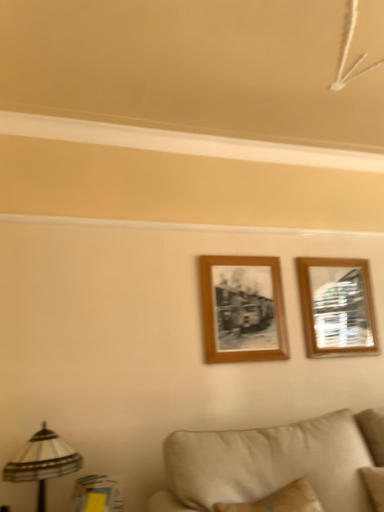
What do you see at coordinates (337, 307) in the screenshot?
I see `wooden picture frame at upper right, marked as the 2th picture frame in a left-to-right arrangement` at bounding box center [337, 307].

What is the approximate width of wooden picture frame at upper right, marked as the 2th picture frame in a left-to-right arrangement?

1.64 inches.

Describe the element at coordinates (243, 309) in the screenshot. I see `wooden photo frame at center, placed as the 1th picture frame when sorted from left to right` at that location.

Measure the distance between point (41, 470) and camera.

5.77 feet.

Locate an element on the screen. beige fabric couch at lower center is located at coordinates (278, 467).

Does wooden photo frame at center, placed as the 1th picture frame when sorted from left to right, have a lesser width compared to beige fabric couch at lower center?

Indeed, wooden photo frame at center, placed as the 1th picture frame when sorted from left to right, has a lesser width compared to beige fabric couch at lower center.

Is wooden photo frame at center, placed as the 1th picture frame when sorted from left to right, positioned with its back to beige fabric couch at lower center?

wooden photo frame at center, placed as the 1th picture frame when sorted from left to right, is not turned away from beige fabric couch at lower center.

Is wooden photo frame at center, which is the second picture frame in right-to-left order, bigger than beige fabric couch at lower center?

No.

From the picture: Considering the relative positions of wooden photo frame at center, which is the second picture frame in right-to-left order, and beige fabric couch at lower center in the image provided, is wooden photo frame at center, which is the second picture frame in right-to-left order, to the right of beige fabric couch at lower center from the viewer's perspective?

Incorrect, wooden photo frame at center, which is the second picture frame in right-to-left order, is not on the right side of beige fabric couch at lower center.

Is beige fabric couch at lower center outside of striped fabric lampshade at lower left?

Yes, beige fabric couch at lower center is not within striped fabric lampshade at lower left.

From the image's perspective, who appears lower, beige fabric couch at lower center or striped fabric lampshade at lower left?

striped fabric lampshade at lower left is shown below in the image.

Is beige fabric couch at lower center with striped fabric lampshade at lower left?

No, beige fabric couch at lower center is not with striped fabric lampshade at lower left.

Can you confirm if beige fabric couch at lower center is smaller than striped fabric lampshade at lower left?

Actually, beige fabric couch at lower center might be larger than striped fabric lampshade at lower left.

Which is more to the left, striped fabric lampshade at lower left or wooden picture frame at upper right, marked as the first picture frame in a right-to-left arrangement?

Positioned to the left is striped fabric lampshade at lower left.

From the image's perspective, is striped fabric lampshade at lower left located beneath wooden picture frame at upper right, marked as the first picture frame in a right-to-left arrangement?

Indeed, from the image's perspective, striped fabric lampshade at lower left is shown beneath wooden picture frame at upper right, marked as the first picture frame in a right-to-left arrangement.

Is striped fabric lampshade at lower left facing towards wooden picture frame at upper right, marked as the 2th picture frame in a left-to-right arrangement?

No, striped fabric lampshade at lower left is not oriented towards wooden picture frame at upper right, marked as the 2th picture frame in a left-to-right arrangement.

Is striped fabric lampshade at lower left located outside beige fabric couch at lower center?

Indeed, striped fabric lampshade at lower left is completely outside beige fabric couch at lower center.

Does striped fabric lampshade at lower left appear on the right side of beige fabric couch at lower center?

Incorrect, striped fabric lampshade at lower left is not on the right side of beige fabric couch at lower center.

Which is nearer, (30, 468) or (301, 455)?

Point (30, 468).

Does striped fabric lampshade at lower left have a smaller size compared to beige fabric couch at lower center?

Yes.

Where is `table lamp below the wooden picture frame at upper right, marked as the first picture frame in a right-to-left arrangement (from the image's perspective)`? table lamp below the wooden picture frame at upper right, marked as the first picture frame in a right-to-left arrangement (from the image's perspective) is located at coordinates (42, 462).

Can you see wooden picture frame at upper right, marked as the 2th picture frame in a left-to-right arrangement, touching striped fabric lampshade at lower left?

They are not placed beside each other.

Can we say wooden picture frame at upper right, marked as the 2th picture frame in a left-to-right arrangement, lies outside striped fabric lampshade at lower left?

Yes, wooden picture frame at upper right, marked as the 2th picture frame in a left-to-right arrangement, is located beyond the bounds of striped fabric lampshade at lower left.

Based on their positions, is wooden picture frame at upper right, marked as the 2th picture frame in a left-to-right arrangement, located to the left or right of striped fabric lampshade at lower left?

wooden picture frame at upper right, marked as the 2th picture frame in a left-to-right arrangement, is positioned on striped fabric lampshade at lower left's right side.

Can you confirm if beige fabric couch at lower center is shorter than wooden picture frame at upper right, marked as the first picture frame in a right-to-left arrangement?

Yes, beige fabric couch at lower center is shorter than wooden picture frame at upper right, marked as the first picture frame in a right-to-left arrangement.

How different are the orientations of beige fabric couch at lower center and wooden picture frame at upper right, marked as the 2th picture frame in a left-to-right arrangement, in degrees?

The facing directions of beige fabric couch at lower center and wooden picture frame at upper right, marked as the 2th picture frame in a left-to-right arrangement, are 1.05 degrees apart.

Are beige fabric couch at lower center and wooden picture frame at upper right, marked as the 2th picture frame in a left-to-right arrangement, making contact?

No, beige fabric couch at lower center is not next to wooden picture frame at upper right, marked as the 2th picture frame in a left-to-right arrangement.

From a real-world perspective, is beige fabric couch at lower center on top of wooden photo frame at center, placed as the 1th picture frame when sorted from left to right?

No, from a real-world perspective, beige fabric couch at lower center is not on top of wooden photo frame at center, placed as the 1th picture frame when sorted from left to right.

In the image, is beige fabric couch at lower center on the left side or the right side of wooden photo frame at center, placed as the 1th picture frame when sorted from left to right?

beige fabric couch at lower center is positioned on wooden photo frame at center, placed as the 1th picture frame when sorted from left to right,'s right side.

How different are the orientations of beige fabric couch at lower center and wooden photo frame at center, which is the second picture frame in right-to-left order, in degrees?

0.644 degrees.

From the image's perspective, who appears lower, beige fabric couch at lower center or wooden photo frame at center, placed as the 1th picture frame when sorted from left to right?

From the image's view, beige fabric couch at lower center is below.

Where is `studio couch lying in front of the wooden photo frame at center, which is the second picture frame in right-to-left order`? The image size is (384, 512). studio couch lying in front of the wooden photo frame at center, which is the second picture frame in right-to-left order is located at coordinates (278, 467).

Where is `table lamp lying below the beige fabric couch at lower center (from the image's perspective)`? table lamp lying below the beige fabric couch at lower center (from the image's perspective) is located at coordinates click(x=42, y=462).

Estimate the real-world distances between objects in this image. Which object is further from beige fabric couch at lower center, striped fabric lampshade at lower left or wooden photo frame at center, which is the second picture frame in right-to-left order?

striped fabric lampshade at lower left is positioned further to the anchor beige fabric couch at lower center.

Looking at this image, considering their positions, is beige fabric couch at lower center positioned further to wooden picture frame at upper right, marked as the 2th picture frame in a left-to-right arrangement, than wooden photo frame at center, placed as the 1th picture frame when sorted from left to right?

Based on the image, beige fabric couch at lower center appears to be further to wooden picture frame at upper right, marked as the 2th picture frame in a left-to-right arrangement.

Considering their positions, is beige fabric couch at lower center positioned closer to striped fabric lampshade at lower left than wooden picture frame at upper right, marked as the first picture frame in a right-to-left arrangement?

Among the two, beige fabric couch at lower center is located nearer to striped fabric lampshade at lower left.

Which object lies nearer to the anchor point striped fabric lampshade at lower left, beige fabric couch at lower center or wooden photo frame at center, which is the second picture frame in right-to-left order?

The object closer to striped fabric lampshade at lower left is beige fabric couch at lower center.

Looking at the image, which one is located closer to beige fabric couch at lower center, wooden picture frame at upper right, marked as the first picture frame in a right-to-left arrangement, or striped fabric lampshade at lower left?

striped fabric lampshade at lower left.

When comparing their distances from wooden picture frame at upper right, marked as the first picture frame in a right-to-left arrangement, does striped fabric lampshade at lower left or wooden photo frame at center, which is the second picture frame in right-to-left order, seem closer?

wooden photo frame at center, which is the second picture frame in right-to-left order, is positioned closer to the anchor wooden picture frame at upper right, marked as the first picture frame in a right-to-left arrangement.

Estimate the real-world distances between objects in this image. Which object is closer to wooden picture frame at upper right, marked as the 2th picture frame in a left-to-right arrangement, wooden photo frame at center, which is the second picture frame in right-to-left order, or beige fabric couch at lower center?

wooden photo frame at center, which is the second picture frame in right-to-left order, lies closer to wooden picture frame at upper right, marked as the 2th picture frame in a left-to-right arrangement, than the other object.

Which object lies nearer to the anchor point beige fabric couch at lower center, wooden photo frame at center, which is the second picture frame in right-to-left order, or striped fabric lampshade at lower left?

Among the two, wooden photo frame at center, which is the second picture frame in right-to-left order, is located nearer to beige fabric couch at lower center.

Locate an element on the screen. picture frame between striped fabric lampshade at lower left and wooden picture frame at upper right, marked as the 2th picture frame in a left-to-right arrangement, from left to right is located at coordinates (243, 309).

In order to click on studio couch between striped fabric lampshade at lower left and wooden picture frame at upper right, marked as the first picture frame in a right-to-left arrangement in this screenshot , I will do `click(278, 467)`.

The height and width of the screenshot is (512, 384). Identify the location of table lamp between beige fabric couch at lower center and wooden photo frame at center, which is the second picture frame in right-to-left order, along the z-axis. (42, 462).

Image resolution: width=384 pixels, height=512 pixels. I want to click on picture frame located between beige fabric couch at lower center and wooden picture frame at upper right, marked as the first picture frame in a right-to-left arrangement, in the depth direction, so click(x=243, y=309).